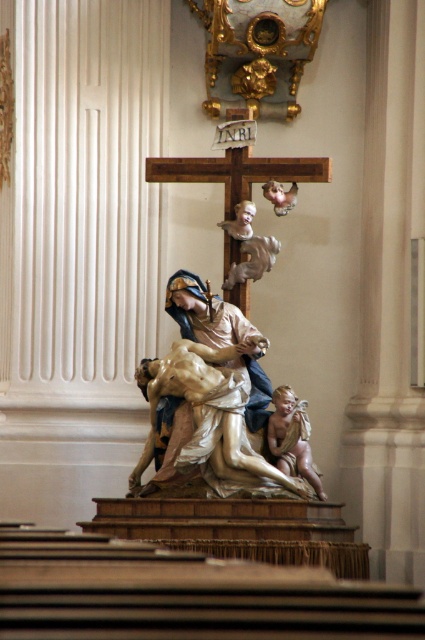
Is smooth beige cherub at center further to camera compared to polished silver cherub at upper center?

No, smooth beige cherub at center is closer to the viewer.

Does smooth beige cherub at center appear under polished silver cherub at upper center?

Correct, smooth beige cherub at center is located below polished silver cherub at upper center.

Who is more distant from viewer, (288, 413) or (252, 259)?

The point (252, 259) is more distant.

Image resolution: width=425 pixels, height=640 pixels. I want to click on smooth beige cherub at center, so click(x=291, y=436).

Is point (232, 358) positioned before point (249, 276)?

Yes, it is.

Which is behind, point (232, 376) or point (261, 250)?

Positioned behind is point (261, 250).

Does point (147, 451) lie in front of point (260, 250)?

Yes, it is.

Locate an element on the screen. The width and height of the screenshot is (425, 640). polished marble statue at center is located at coordinates 207,410.

Is point (192, 396) positioned after point (297, 428)?

No, it is not.

Between polished marble statue at center and smooth beige cherub at center, which one appears on the right side from the viewer's perspective?

Positioned to the right is smooth beige cherub at center.

The height and width of the screenshot is (640, 425). I want to click on polished marble statue at center, so click(x=207, y=410).

What are the coordinates of `polished marble statue at center` in the screenshot? It's located at (207, 410).